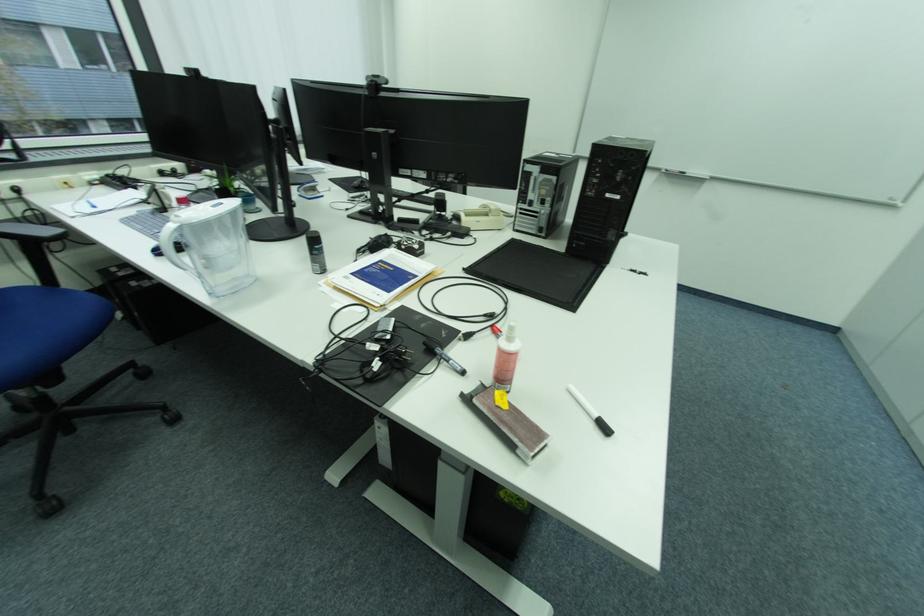
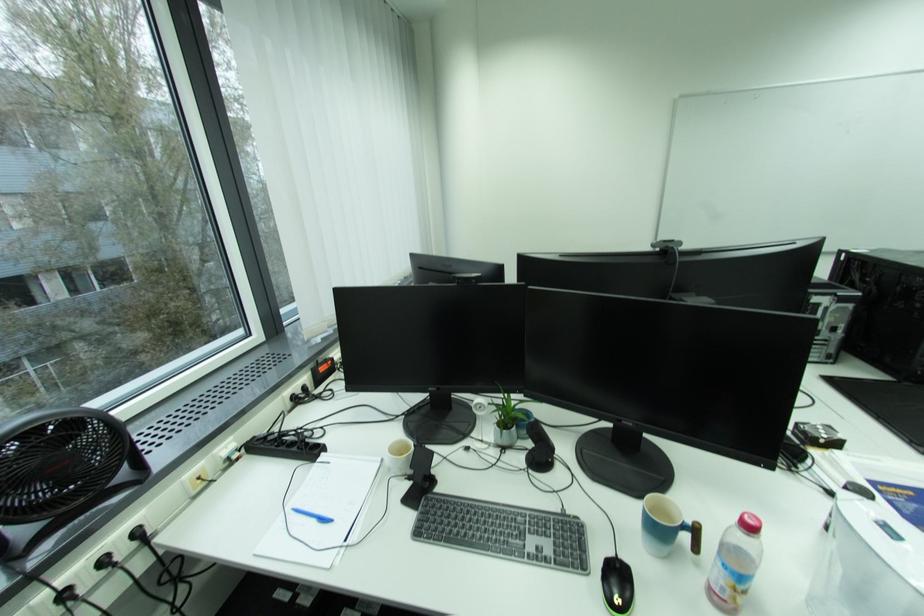
Question: What movement of the cameraman would produce the second image?

Choices:
 (A) Left
 (B) Right
 (C) Forward
 (D) Backward

Answer: (A)